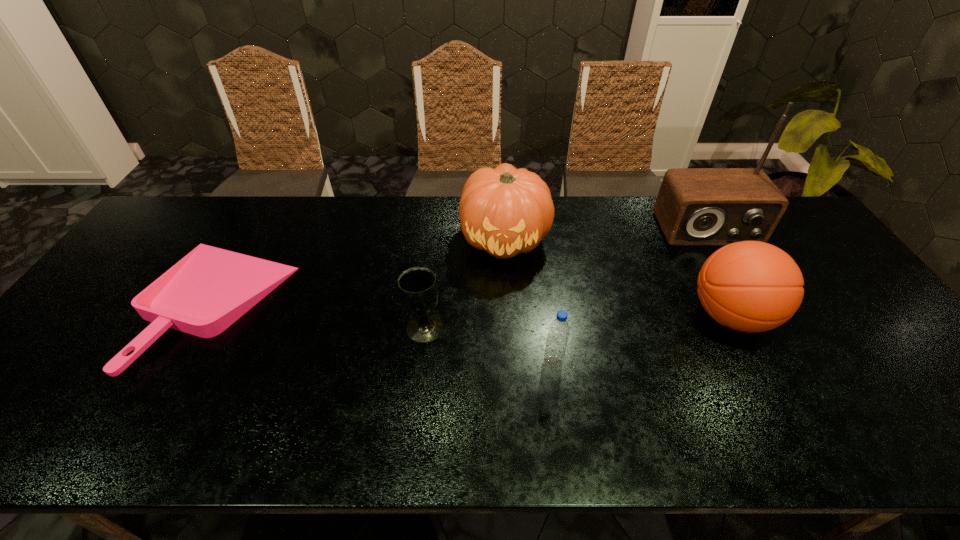
Where is `vacant space at the right edge`? This screenshot has height=540, width=960. vacant space at the right edge is located at coordinates (791, 249).

In the image, there is a desktop. What are the coordinates of `vacant area at the far left corner` in the screenshot? It's located at (x=203, y=210).

This screenshot has width=960, height=540. Identify the location of vacant space at the near left corner of the desktop. (30, 438).

The height and width of the screenshot is (540, 960). Find the location of `vacant area at the far right corner of the desktop`. vacant area at the far right corner of the desktop is located at coordinates (794, 236).

Locate an element on the screen. This screenshot has height=540, width=960. vacant region between the pumpkin and the water bottle is located at coordinates (529, 300).

Find the location of a particular element. vacant space in between the second object from left to right and the water bottle is located at coordinates (489, 345).

The height and width of the screenshot is (540, 960). In order to click on unoccupied area between the pumpkin and the dustpan in this screenshot , I will do `click(360, 271)`.

The width and height of the screenshot is (960, 540). What are the coordinates of `unoccupied area between the water bottle and the shortest object` in the screenshot? It's located at (384, 333).

Locate an element on the screen. This screenshot has height=540, width=960. free spot between the pumpkin and the tallest object is located at coordinates (606, 234).

Find the location of a particular element. This screenshot has width=960, height=540. free area in between the water bottle and the chalice is located at coordinates (489, 345).